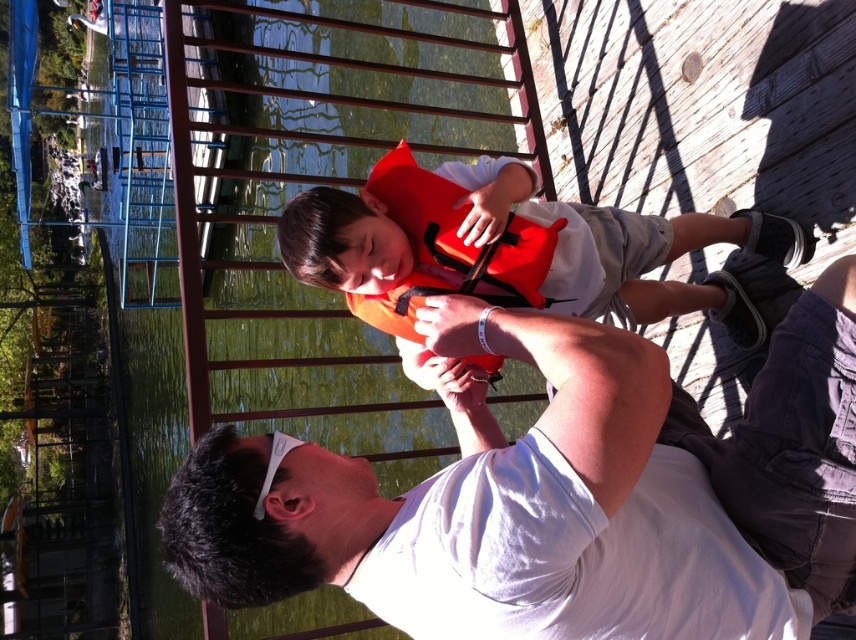
Question: Is white matte shirt at center bigger than orange matte life jacket at center?

Choices:
 (A) yes
 (B) no

Answer: (A)

Question: Considering the real-world distances, which object is farthest from the white matte shirt at center?

Choices:
 (A) orange matte life jacket at center
 (B) orange life vest at center

Answer: (B)

Question: Can you confirm if orange life vest at center is positioned to the left of orange matte life jacket at center?

Choices:
 (A) no
 (B) yes

Answer: (A)

Question: Which point is farther to the camera?

Choices:
 (A) (195, 544)
 (B) (437, 228)

Answer: (B)

Question: Which is nearer to the orange life vest at center?

Choices:
 (A) white matte shirt at center
 (B) orange matte life jacket at center

Answer: (B)

Question: Can you confirm if white matte shirt at center is positioned to the right of orange matte life jacket at center?

Choices:
 (A) yes
 (B) no

Answer: (A)